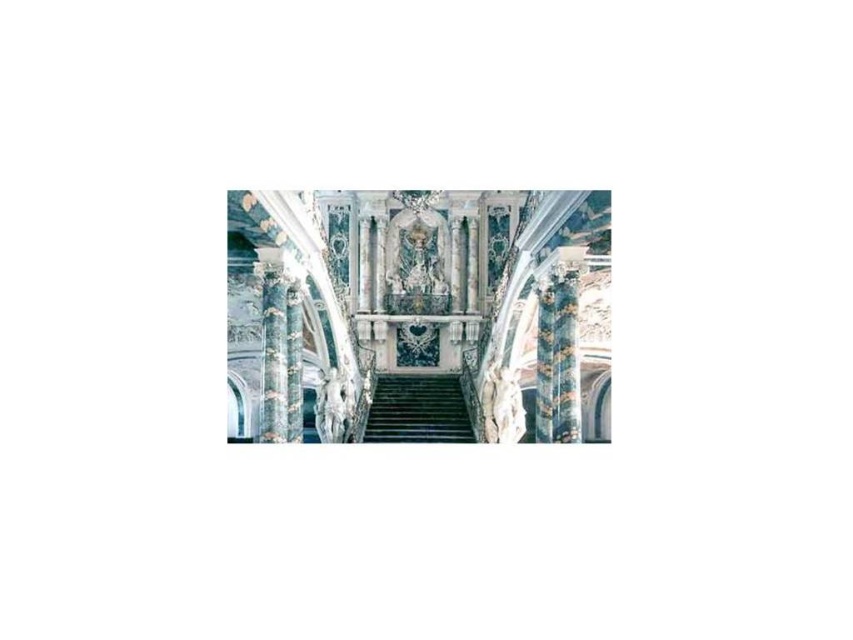
Question: Can you confirm if white marble staircase at center is positioned to the left of green marble stairs at center?

Choices:
 (A) yes
 (B) no

Answer: (A)

Question: Which point is farther from the camera taking this photo?

Choices:
 (A) (418, 412)
 (B) (358, 356)

Answer: (B)

Question: Is white marble staircase at center closer to the viewer compared to green marble stairs at center?

Choices:
 (A) yes
 (B) no

Answer: (A)

Question: Which object is farther from the camera taking this photo?

Choices:
 (A) green marble stairs at center
 (B) white marble staircase at center

Answer: (A)

Question: Which point is closer to the camera?

Choices:
 (A) (306, 378)
 (B) (389, 426)

Answer: (B)

Question: Is white marble staircase at center in front of green marble stairs at center?

Choices:
 (A) no
 (B) yes

Answer: (B)